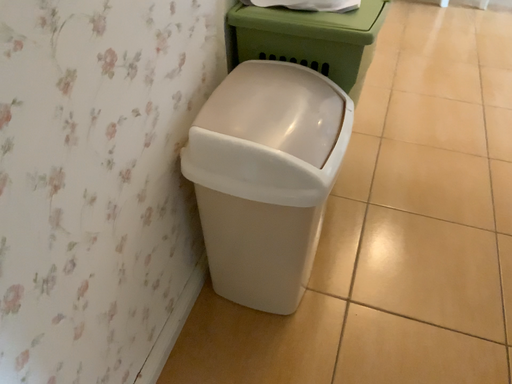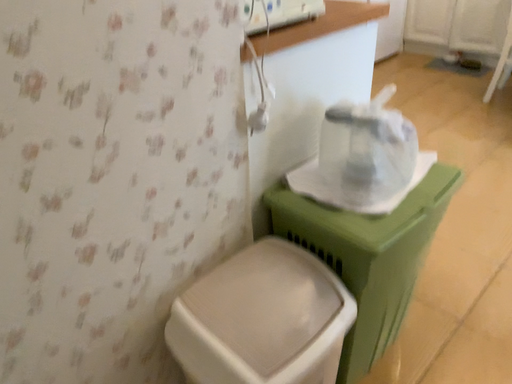
Question: Which way did the camera rotate in the video?

Choices:
 (A) rotated left
 (B) rotated right

Answer: (A)